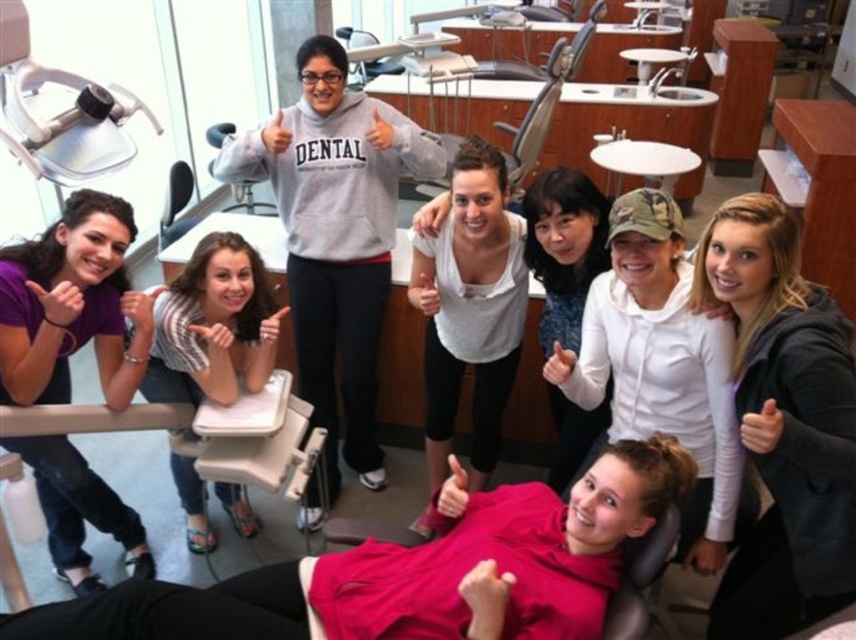
Question: Which point is farther to the camera?

Choices:
 (A) (712, 550)
 (B) (387, 125)
 (C) (72, 292)

Answer: (B)

Question: Can you confirm if dark brown hair at center is smaller than white matte tank top at center?

Choices:
 (A) no
 (B) yes

Answer: (B)

Question: Is gray fabric chair at center bigger than matte gray sweatshirt at center?

Choices:
 (A) yes
 (B) no

Answer: (A)

Question: Is white matte hoodie at center positioned behind dark blue sweater at center?

Choices:
 (A) no
 (B) yes

Answer: (A)

Question: Based on their relative distances, which object is nearer to the gray sweatshirt at center?

Choices:
 (A) white matte hand at center
 (B) striped fabric shirt at center

Answer: (B)

Question: Estimate the real-world distances between objects in this image. Which object is farther from the matte plastic ring at lower left?

Choices:
 (A) matte white hand at center
 (B) striped fabric shirt at center
 (C) white matte hoodie at center
 (D) white matte tank top at center

Answer: (C)